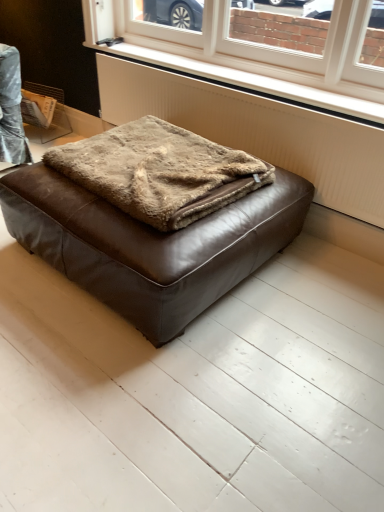
Identify the location of vacant space situated above white textured radiator at center (from a real-world perspective). (236, 82).